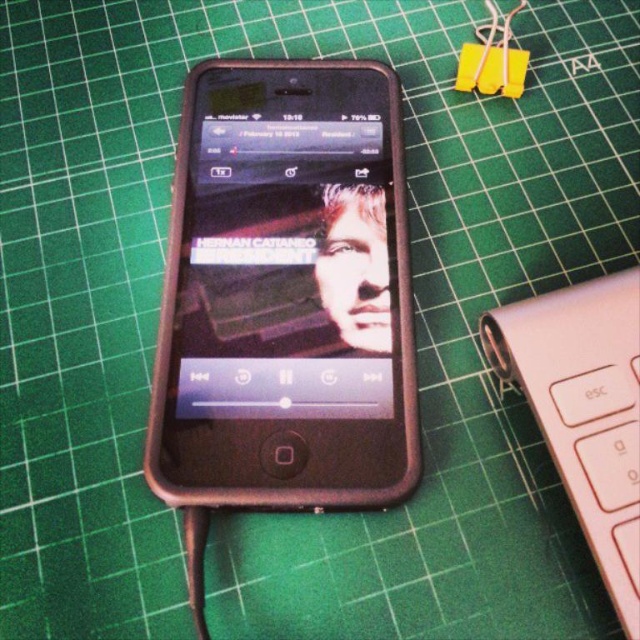
Question: Does black matte smartphone at center have a smaller size compared to pink matte keyboard at lower right?

Choices:
 (A) yes
 (B) no

Answer: (B)

Question: Is black matte smartphone at center below pink matte keyboard at lower right?

Choices:
 (A) yes
 (B) no

Answer: (B)

Question: Is black matte smartphone at center above pink matte keyboard at lower right?

Choices:
 (A) no
 (B) yes

Answer: (B)